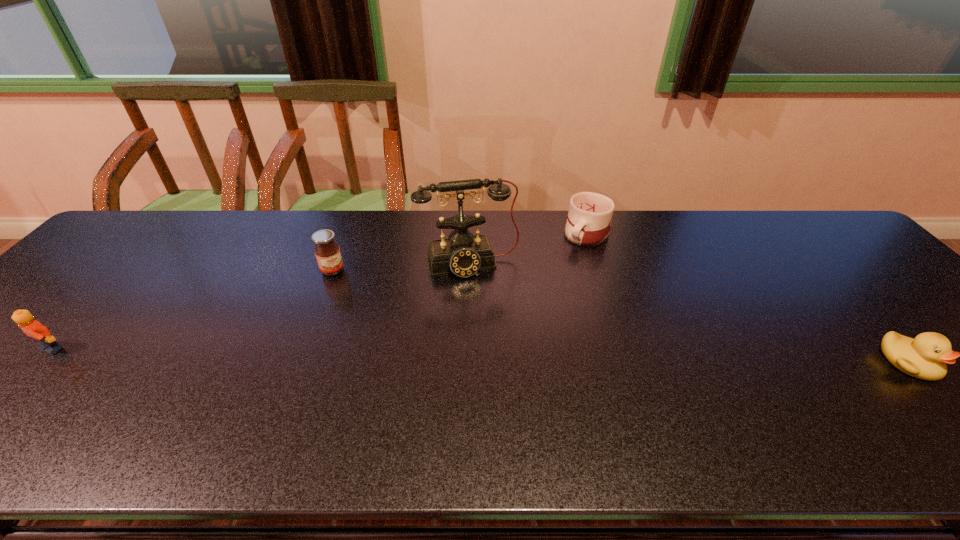
Find the location of a particular element. The height and width of the screenshot is (540, 960). free spot between the leftmost object and the mug is located at coordinates (320, 292).

The width and height of the screenshot is (960, 540). Identify the location of free space between the Lego and the rightmost object. (480, 355).

Identify the location of vacant space that is in between the Lego and the duckling. This screenshot has width=960, height=540. (480, 355).

Locate an element on the screen. The image size is (960, 540). unoccupied position between the rightmost object and the mug is located at coordinates (748, 299).

Where is `vacant area between the tallest object and the fourth object from left to right`? vacant area between the tallest object and the fourth object from left to right is located at coordinates (528, 249).

At what (x,y) coordinates should I click in order to perform the action: click on free space that is in between the duckling and the leftmost object. Please return your answer as a coordinate pair (x, y). The image size is (960, 540). Looking at the image, I should click on (480, 355).

This screenshot has width=960, height=540. In order to click on object that can be found as the closest to the second object from left to right in this screenshot , I will do `click(464, 254)`.

The height and width of the screenshot is (540, 960). Identify the location of object that is the second closest one to the third object from left to right. (327, 252).